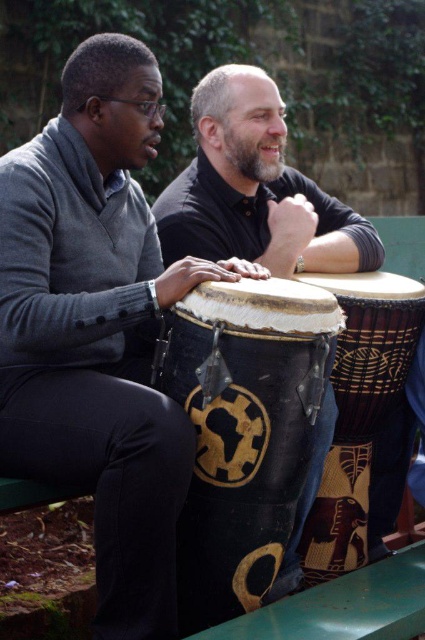
Question: Is matte black drum at left to the right of matte black drum at center from the viewer's perspective?

Choices:
 (A) no
 (B) yes

Answer: (A)

Question: Is matte black drum at left bigger than matte black drum at center?

Choices:
 (A) yes
 (B) no

Answer: (A)

Question: Which object appears closest to the camera in this image?

Choices:
 (A) black textured drum at center
 (B) matte black drum at center

Answer: (A)

Question: Is matte black drum at left further to the viewer compared to natural wood drum at center?

Choices:
 (A) yes
 (B) no

Answer: (B)

Question: Which point is farther to the camera?

Choices:
 (A) (138, 241)
 (B) (295, 502)
 (C) (252, 241)
 (D) (354, 400)

Answer: (C)

Question: Which object is farther from the camera taking this photo?

Choices:
 (A) natural wood drum at center
 (B) black textured drum at center
 (C) smooth black shirt at center
 (D) matte black drum at center

Answer: (D)